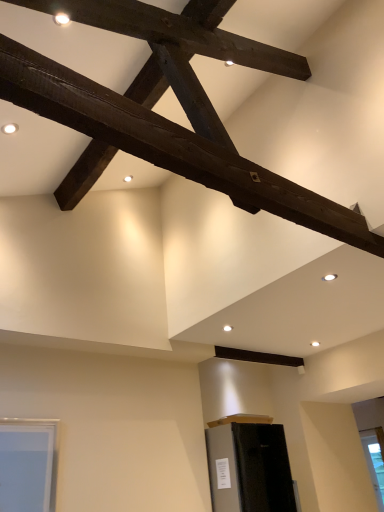
Question: From the image's perspective, is clear glass window at lower right above dark brown wood beam at upper center?

Choices:
 (A) yes
 (B) no

Answer: (B)

Question: Are clear glass window at lower right and dark brown wood beam at upper center beside each other?

Choices:
 (A) no
 (B) yes

Answer: (A)

Question: From the image's perspective, is clear glass window at lower right under dark brown wood beam at upper center?

Choices:
 (A) no
 (B) yes

Answer: (B)

Question: Considering the relative sizes of clear glass window at lower right and dark brown wood beam at upper center in the image provided, is clear glass window at lower right wider than dark brown wood beam at upper center?

Choices:
 (A) yes
 (B) no

Answer: (B)

Question: Is clear glass window at lower right outside of dark brown wood beam at upper center?

Choices:
 (A) no
 (B) yes

Answer: (B)

Question: Is clear glass window at lower right taller or shorter than matte black refrigerator at lower center?

Choices:
 (A) tall
 (B) short

Answer: (A)

Question: From a real-world perspective, is clear glass window at lower right above or below matte black refrigerator at lower center?

Choices:
 (A) below
 (B) above

Answer: (A)

Question: Considering their positions, is clear glass window at lower right located in front of or behind matte black refrigerator at lower center?

Choices:
 (A) front
 (B) behind

Answer: (B)

Question: Is clear glass window at lower right bigger or smaller than matte black refrigerator at lower center?

Choices:
 (A) big
 (B) small

Answer: (B)

Question: Would you say dark brown wood beam at upper center is to the left or to the right of matte black refrigerator at lower center in the picture?

Choices:
 (A) right
 (B) left

Answer: (B)

Question: From the image's perspective, is dark brown wood beam at upper center positioned above or below matte black refrigerator at lower center?

Choices:
 (A) above
 (B) below

Answer: (A)

Question: Would you say dark brown wood beam at upper center is inside or outside matte black refrigerator at lower center?

Choices:
 (A) outside
 (B) inside

Answer: (A)

Question: In terms of width, does dark brown wood beam at upper center look wider or thinner when compared to matte black refrigerator at lower center?

Choices:
 (A) wide
 (B) thin

Answer: (A)

Question: In terms of size, does matte black refrigerator at lower center appear bigger or smaller than clear glass window at lower right?

Choices:
 (A) big
 (B) small

Answer: (A)

Question: Is matte black refrigerator at lower center inside or outside of clear glass window at lower right?

Choices:
 (A) outside
 (B) inside

Answer: (A)